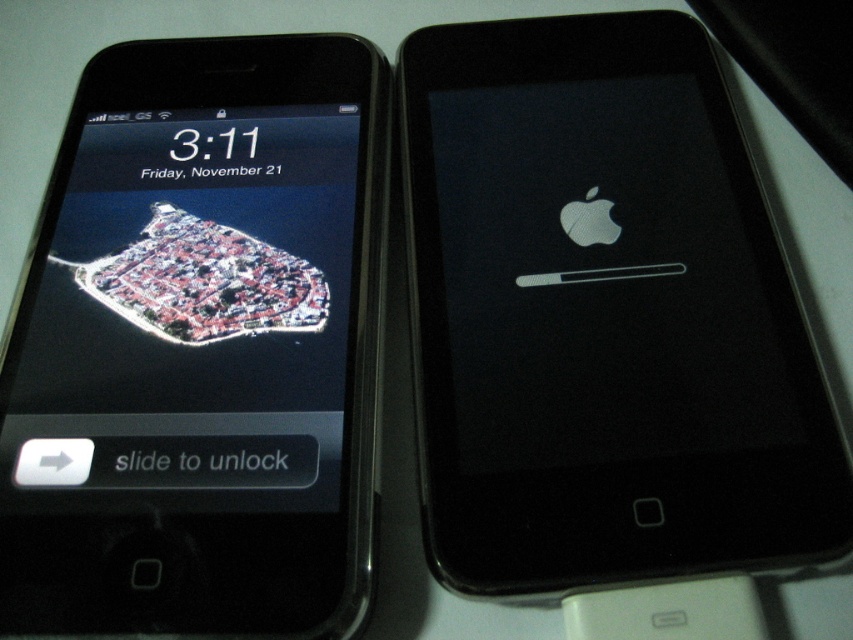
Question: Is black matte iphone at right wider than black glossy smartphone at left?

Choices:
 (A) yes
 (B) no

Answer: (A)

Question: Is black matte iphone at right above black glossy smartphone at left?

Choices:
 (A) no
 (B) yes

Answer: (B)

Question: Can you confirm if black matte iphone at right is thinner than black glossy smartphone at left?

Choices:
 (A) no
 (B) yes

Answer: (A)